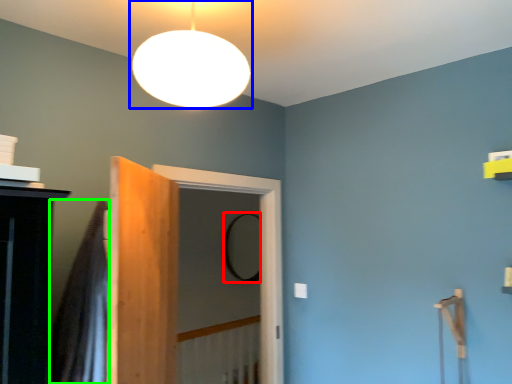
Question: Which object is positioned farthest from mirror (highlighted by a red box)? Select from lamp (highlighted by a blue box) and shower curtain (highlighted by a green box).

Choices:
 (A) lamp
 (B) shower curtain

Answer: (A)